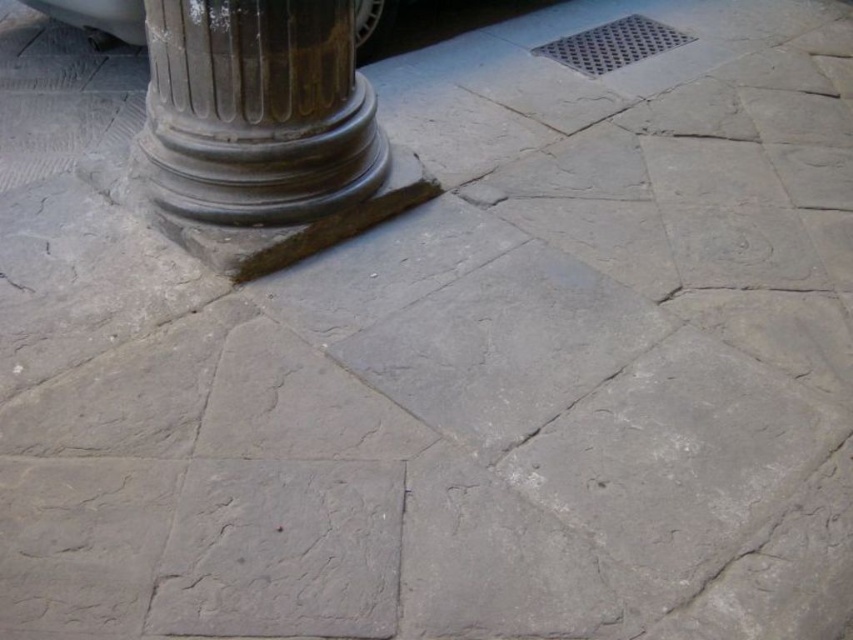
Question: Is gray stone column at left thinner than shiny silver car at upper left?

Choices:
 (A) yes
 (B) no

Answer: (A)

Question: Which of the following is the closest to the observer?

Choices:
 (A) (76, 1)
 (B) (363, 92)

Answer: (B)

Question: Which object appears farthest from the camera in this image?

Choices:
 (A) shiny silver car at upper left
 (B) gray stone column at left

Answer: (A)

Question: Considering the relative positions of gray stone column at left and shiny silver car at upper left in the image provided, where is gray stone column at left located with respect to shiny silver car at upper left?

Choices:
 (A) above
 (B) below

Answer: (B)

Question: Is gray stone column at left bigger than shiny silver car at upper left?

Choices:
 (A) yes
 (B) no

Answer: (B)

Question: Which object appears farthest from the camera in this image?

Choices:
 (A) shiny silver car at upper left
 (B) gray stone column at left

Answer: (A)